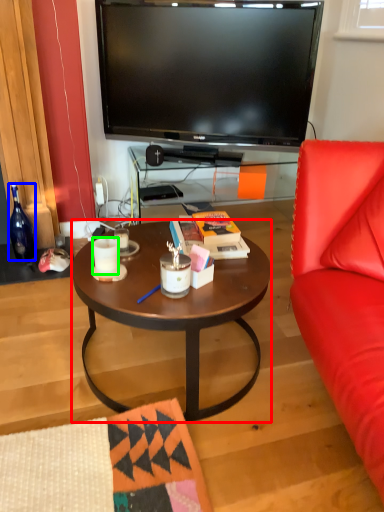
Question: Estimate the real-world distances between objects in this image. Which object is farther from coffee table (highlighted by a red box), bottle (highlighted by a blue box) or coffee cup (highlighted by a green box)?

Choices:
 (A) bottle
 (B) coffee cup

Answer: (A)